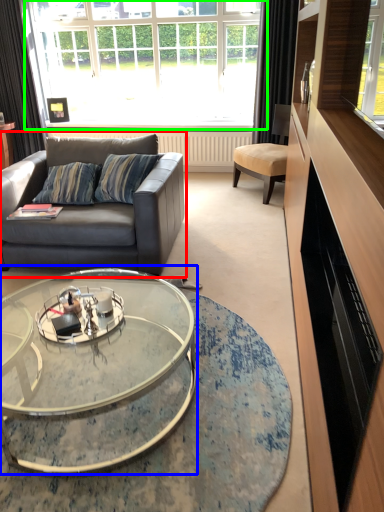
Question: Which object is the farthest from studio couch (highlighted by a red box)? Choose among these: coffee table (highlighted by a blue box) or window (highlighted by a green box).

Choices:
 (A) coffee table
 (B) window

Answer: (B)